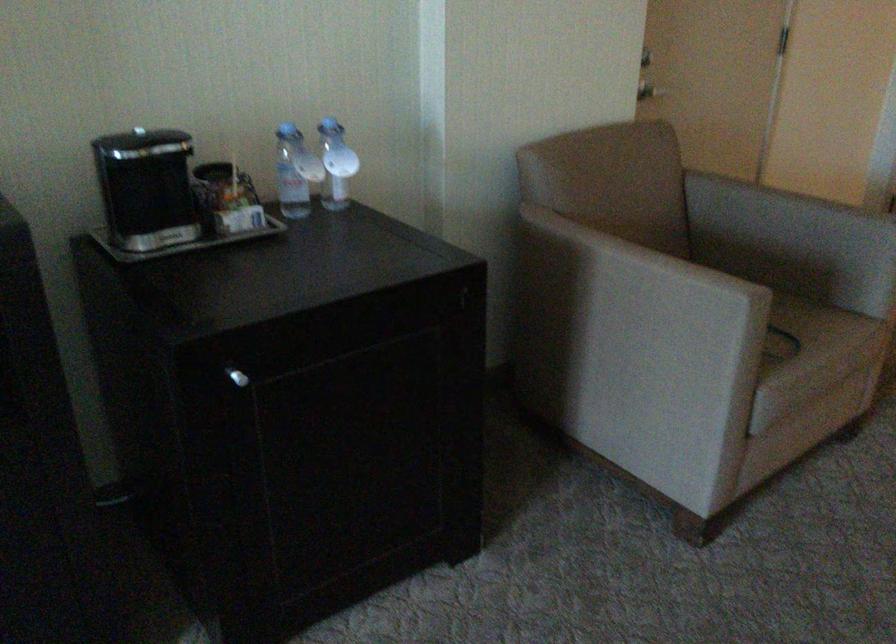
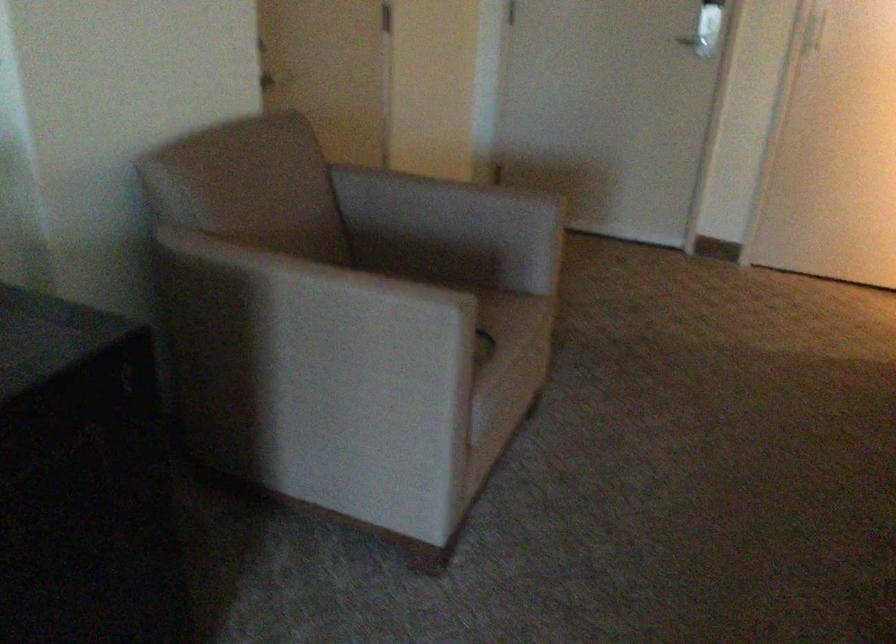
Question: The first image is from the beginning of the video and the second image is from the end. How did the camera likely rotate when shooting the video?

Choices:
 (A) Left
 (B) Right
 (C) Up
 (D) Down

Answer: (B)